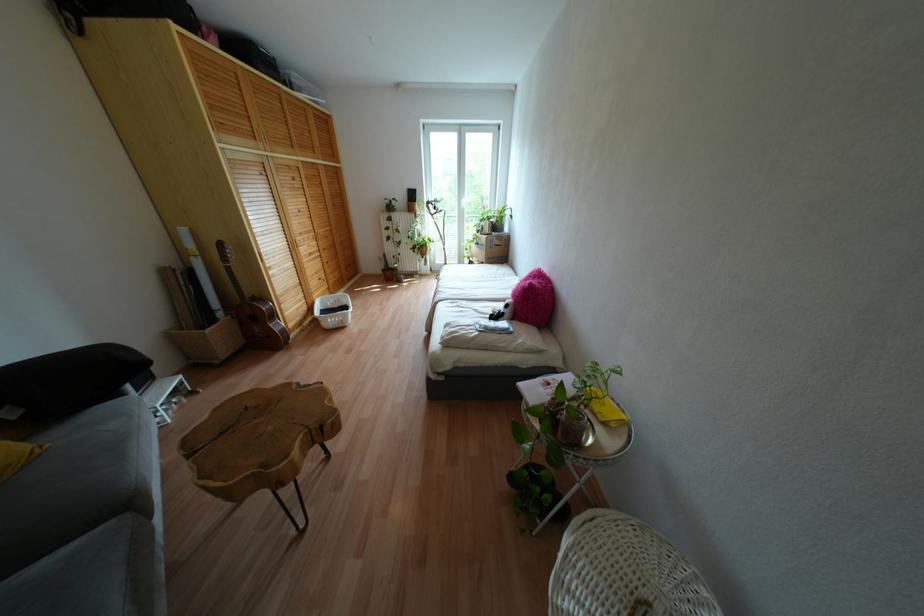
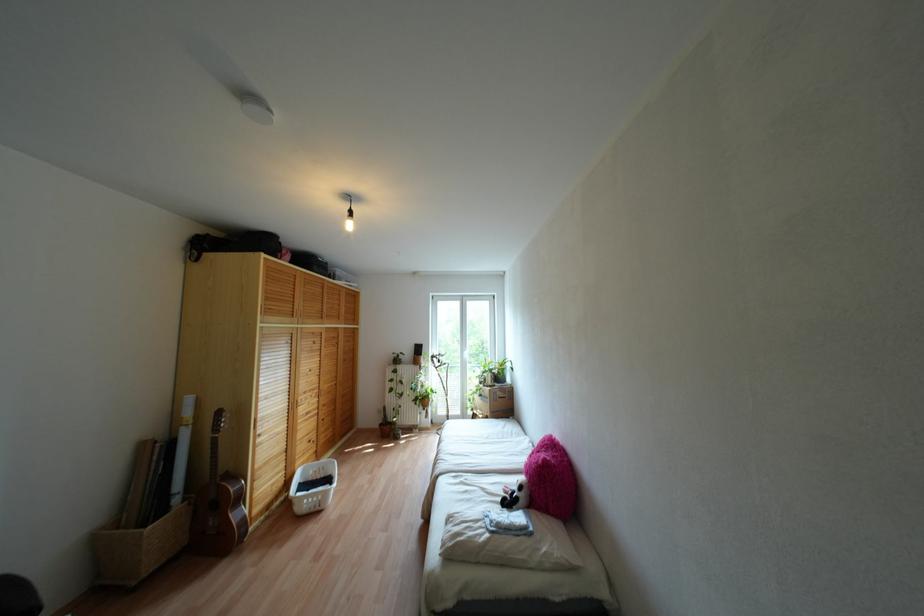
Locate, in the second image, the point that corresponds to [529,284] in the first image.

(543, 460)